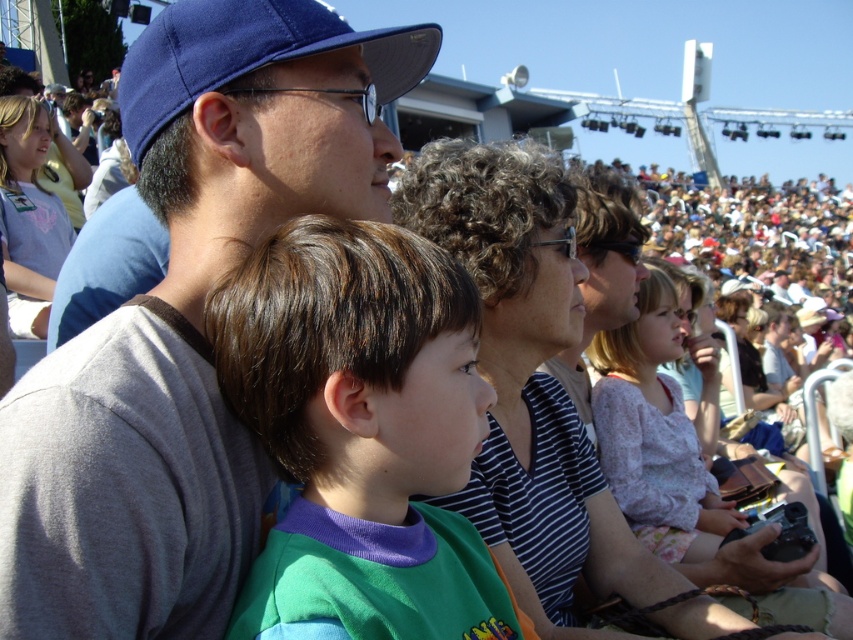
Measure the distance between point (392, 387) and camera.

A distance of 12.53 meters exists between point (392, 387) and camera.

The height and width of the screenshot is (640, 853). I want to click on green fabric shirt at center, so click(x=361, y=435).

Measure the distance between point (265, 614) and camera.

They are 10.71 meters apart.

Where is `green fabric shirt at center`? The height and width of the screenshot is (640, 853). green fabric shirt at center is located at coordinates (361, 435).

Is point (202, 172) in front of point (378, 563)?

No, (202, 172) is behind (378, 563).

In the scene shown: Who is taller, blue fabric cap at upper left or green fabric shirt at center?

With more height is blue fabric cap at upper left.

Which is in front, point (225, 244) or point (277, 324)?

Point (277, 324)

The height and width of the screenshot is (640, 853). I want to click on blue fabric cap at upper left, so click(187, 320).

Is point (137, 298) farther from camera compared to point (381, 61)?

No, (137, 298) is closer to viewer.

Measure the distance between blue fabric cap at upper left and blue fabric baseball cap at upper left.

The distance of blue fabric cap at upper left from blue fabric baseball cap at upper left is 2.03 meters.

Is point (146, 184) behind point (405, 51)?

No, (146, 184) is in front of (405, 51).

Find the location of a particular element. The image size is (853, 640). blue fabric cap at upper left is located at coordinates (187, 320).